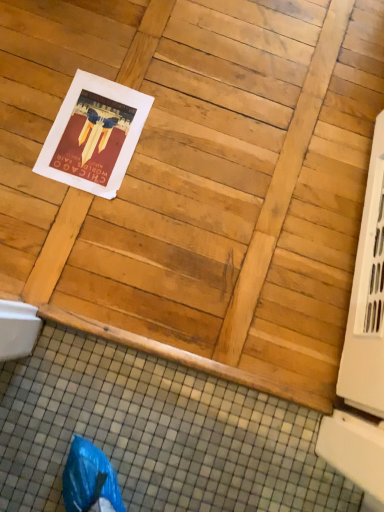
Where is `vacant area to the right of white paper poster at upper left`? The height and width of the screenshot is (512, 384). vacant area to the right of white paper poster at upper left is located at coordinates (172, 170).